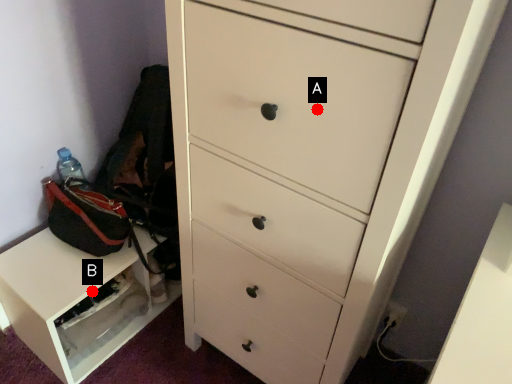
Question: Two points are circled on the image, labeled by A and B beside each circle. Which point is further to the camera?

Choices:
 (A) A is further
 (B) B is further

Answer: (B)